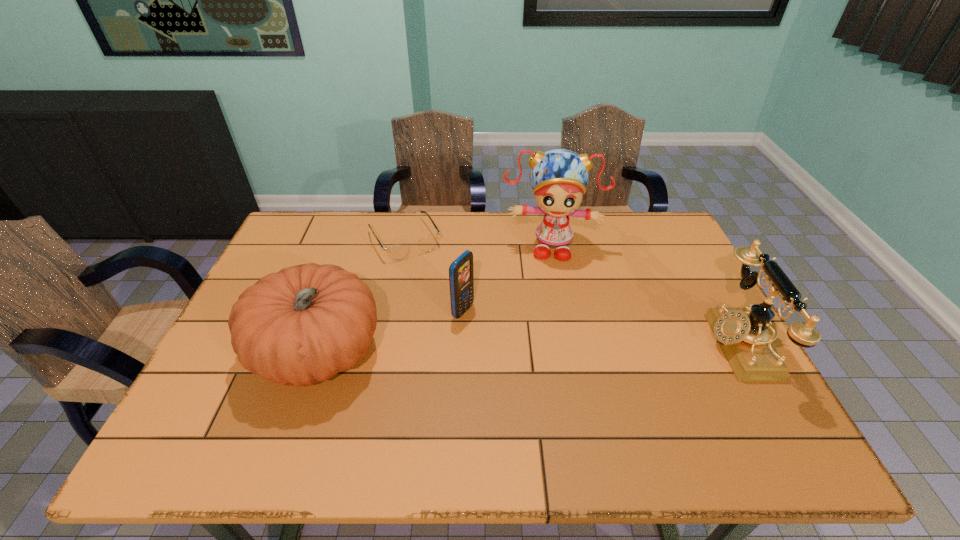
Identify the location of free space at the near left corner of the desktop. (272, 385).

This screenshot has width=960, height=540. What are the coordinates of `unoccupied area between the fourth object from left to right and the cellular telephone` in the screenshot? It's located at (507, 279).

In order to click on free space between the pumpkin and the doll in this screenshot , I will do `click(434, 299)`.

Find the location of a particular element. empty location between the pumpkin and the third object from left to right is located at coordinates (391, 332).

Where is `free space between the cellular telephone and the doll`? free space between the cellular telephone and the doll is located at coordinates (507, 279).

Locate an element on the screen. The width and height of the screenshot is (960, 540). free space between the doll and the shortest object is located at coordinates (477, 242).

You are a GUI agent. You are given a task and a screenshot of the screen. Output one action in this format:
    pyautogui.click(x=<x>, y=<y>)
    Task: Click on the free area in between the pumpkin and the rightmost object
    The image size is (960, 540).
    Given the screenshot: What is the action you would take?
    pyautogui.click(x=527, y=348)

This screenshot has width=960, height=540. Find the location of `empty space that is in between the second object from right to left and the telephone`. empty space that is in between the second object from right to left and the telephone is located at coordinates (643, 295).

Identify the location of blank region between the spectacles and the tallest object. 477,242.

Identify the location of the third closest object relative to the rightmost object. (396, 252).